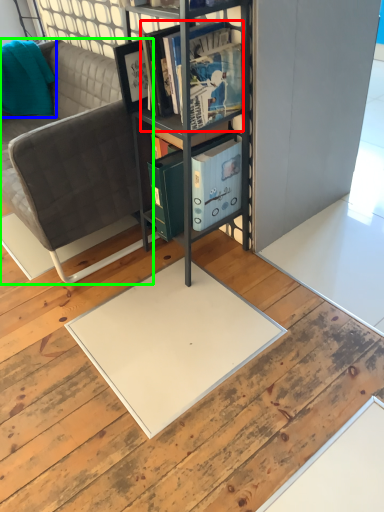
Question: Considering the real-world distances, which object is closest to book (highlighted by a red box)? pillow (highlighted by a blue box) or studio couch (highlighted by a green box).

Choices:
 (A) pillow
 (B) studio couch

Answer: (B)